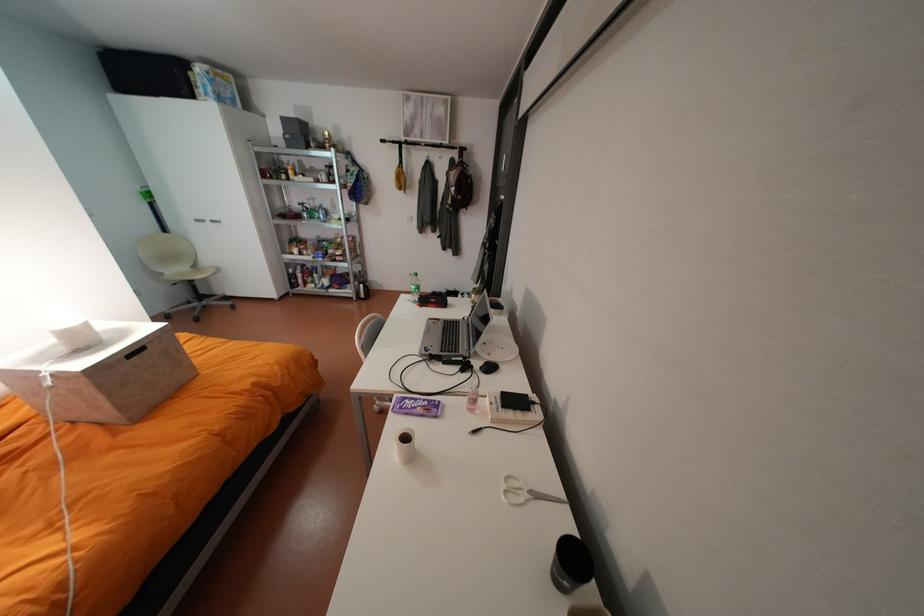
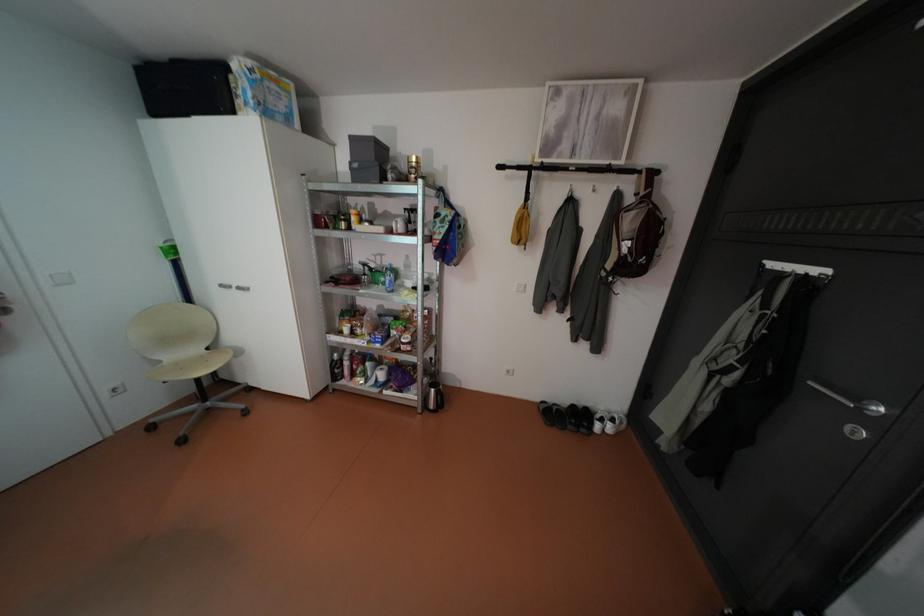
Find the pixel in the second image that matches point 222,220 in the first image.

(248, 286)